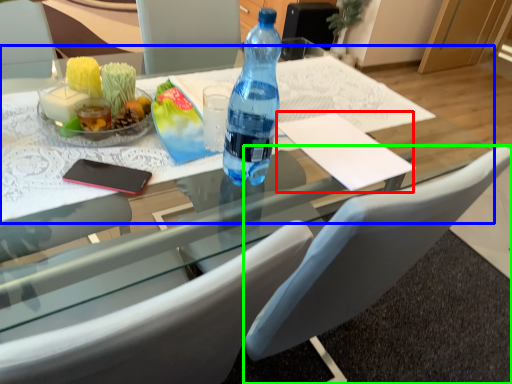
Question: Which object is the farthest from notepad (highlighted by a red box)? Choose among these: round table (highlighted by a blue box) or chair (highlighted by a green box).

Choices:
 (A) round table
 (B) chair

Answer: (B)